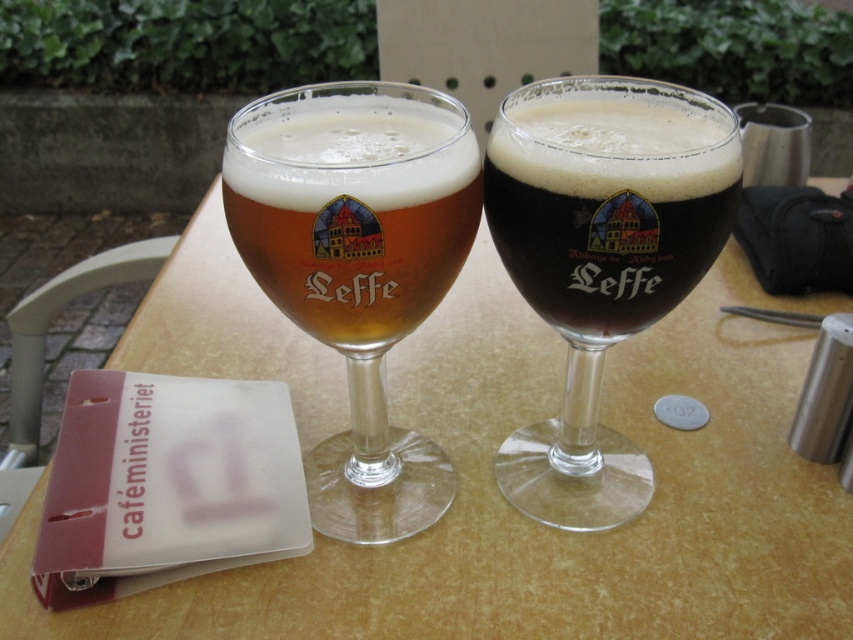
Where is the wooden table at center located in the image?

The wooden table at center is located at point (538,524).

You are at a bar and want to order a Leffe beer. The bartender points to the two glasses in front of you and says, which one is the dark brown glass at center? Please describe its position relative to the translucent glass beer glass at center.

The dark brown glass at center is positioned on the right side of the translucent glass beer glass at center.